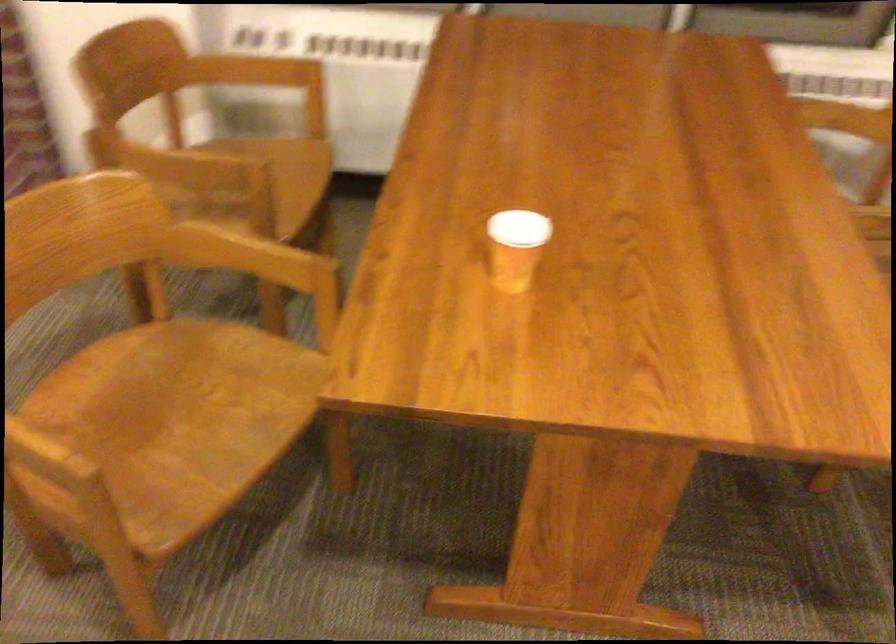
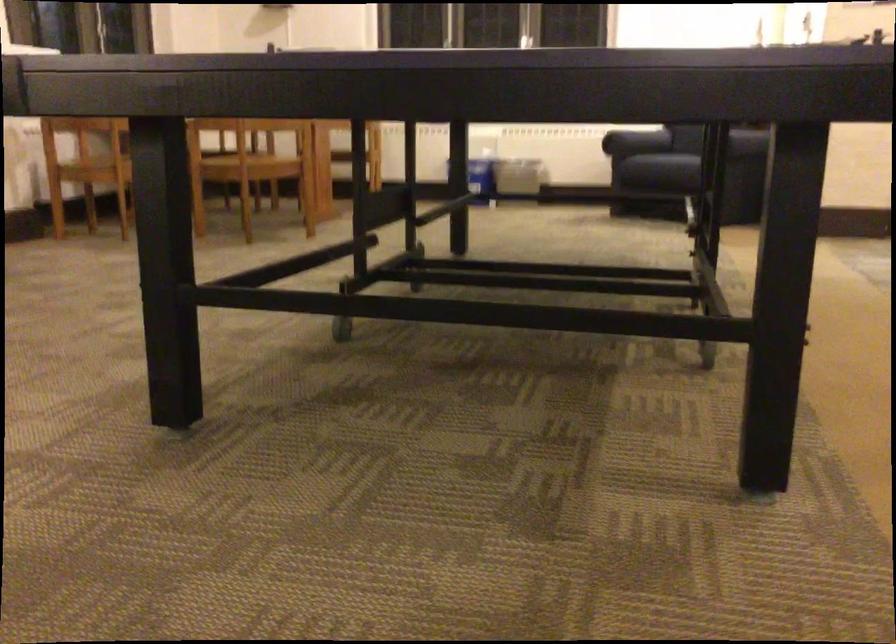
Question: I am providing you with two images of the same scene from different viewpoints. Please identify which objects are invisible in image2.

Choices:
 (A) black travel case
 (B) sofa armrest
 (C) sofa sitting surface
 (D) paper cup

Answer: (D)